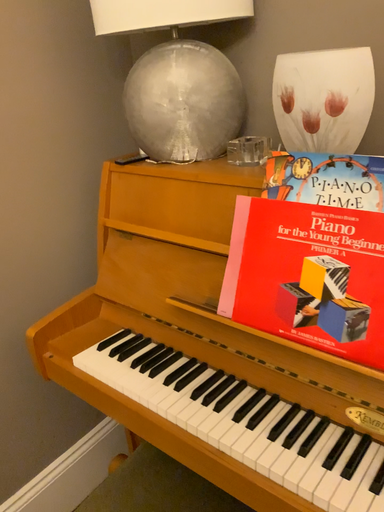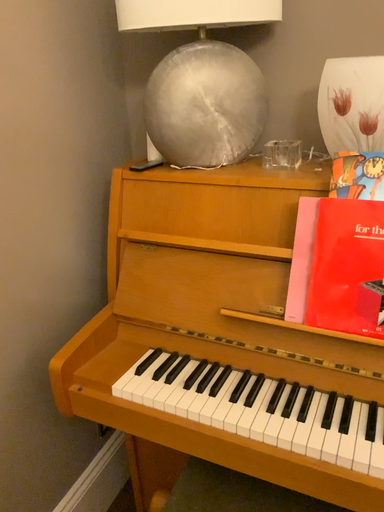
Question: How did the camera likely rotate when shooting the video?

Choices:
 (A) rotated left
 (B) rotated right

Answer: (B)